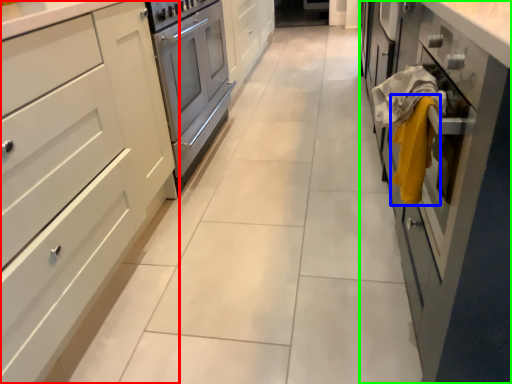
Question: Which object is the closest to the cabinetry (highlighted by a red box)? Choose among these: blanket (highlighted by a blue box) or cabinetry (highlighted by a green box).

Choices:
 (A) blanket
 (B) cabinetry

Answer: (A)